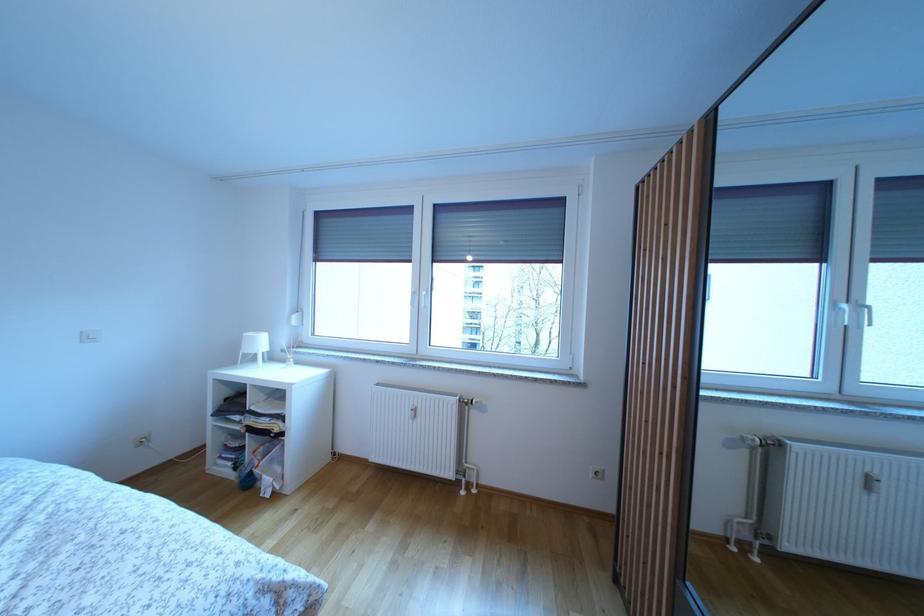
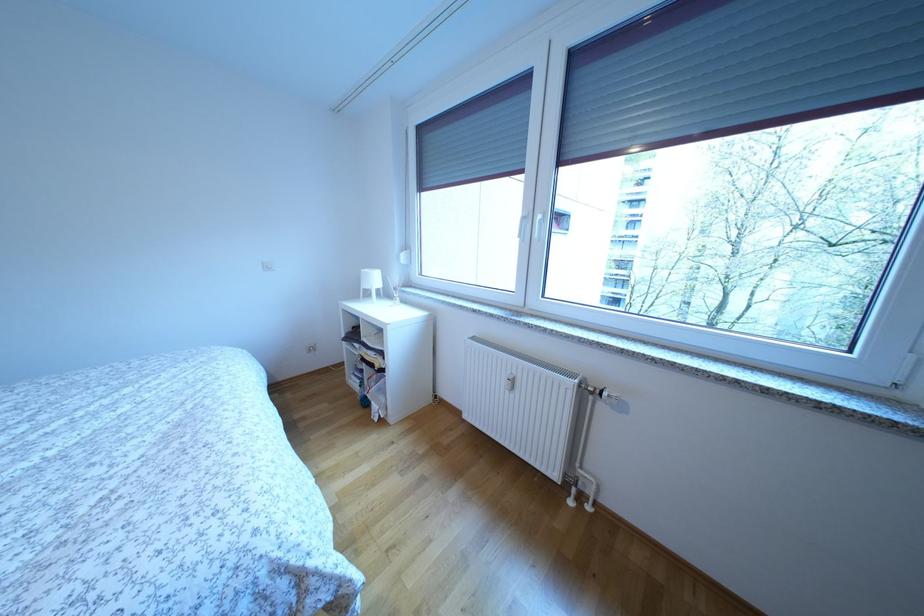
Question: The camera is either moving clockwise (left) or counter-clockwise (right) around the object. The first image is from the beginning of the video and the second image is from the end. Is the camera moving left or right when shooting the video?

Choices:
 (A) Left
 (B) Right

Answer: (B)